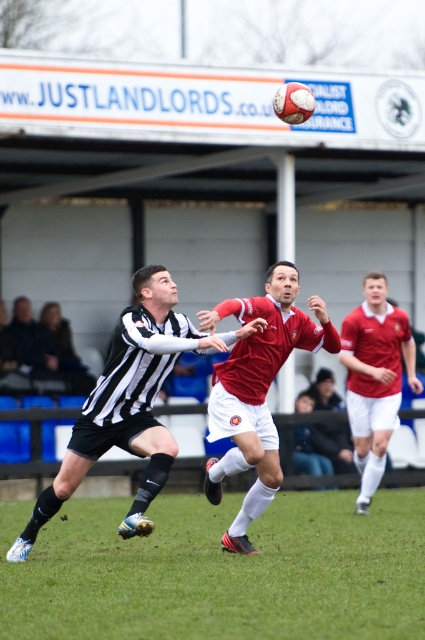
Question: Which object is the farthest from the green grass at center?

Choices:
 (A) red jersey at right
 (B) black and white striped jersey at center

Answer: (A)

Question: Where is green grass at center located in relation to red jersey at right in the image?

Choices:
 (A) left
 (B) right

Answer: (A)

Question: Which of the following is the farthest from the observer?

Choices:
 (A) (368, 444)
 (B) (107, 420)
 (C) (272, 337)

Answer: (A)

Question: Which of the following is the closest to the observer?

Choices:
 (A) (393, 326)
 (B) (351, 560)

Answer: (B)

Question: Is black and white striped jersey at center further to the viewer compared to red matte soccer player at center?

Choices:
 (A) yes
 (B) no

Answer: (B)

Question: Can you confirm if red matte soccer player at center is thinner than red jersey at right?

Choices:
 (A) no
 (B) yes

Answer: (A)